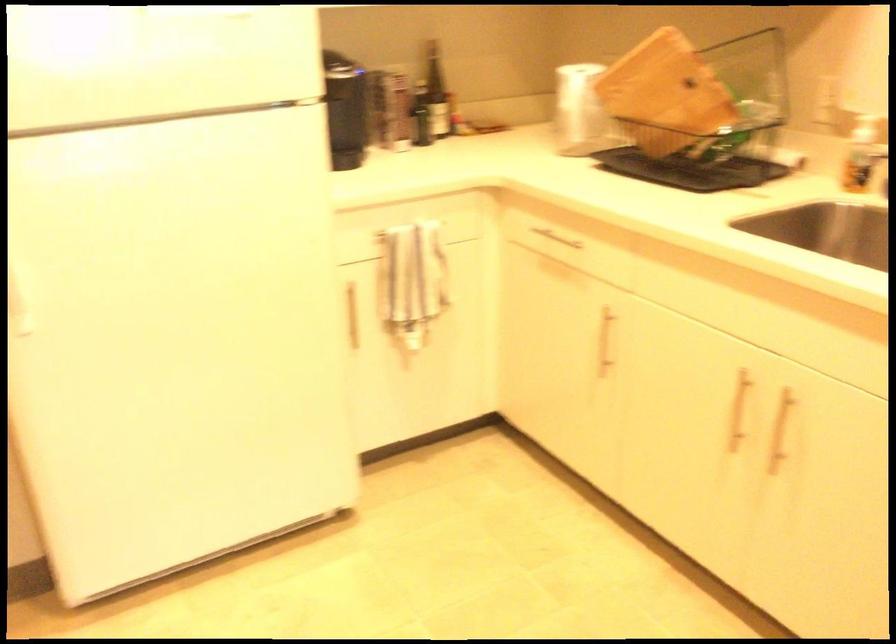
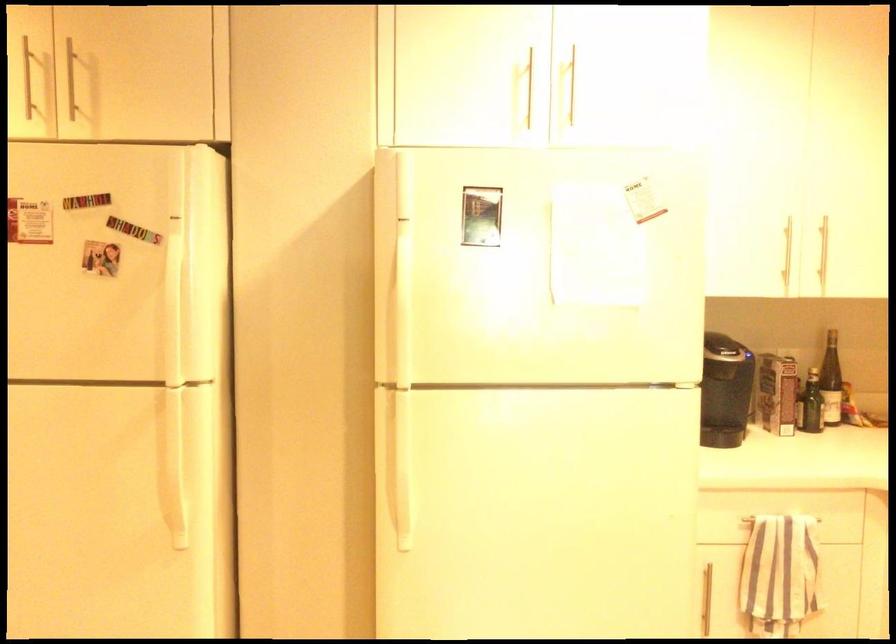
The point at (435, 93) is marked in the first image. Where is the corresponding point in the second image?

(831, 381)